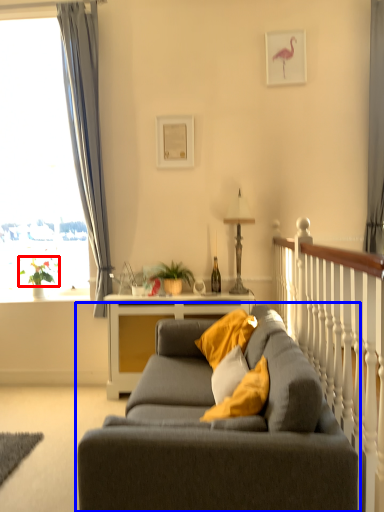
Question: Which object appears closest to the camera in this image, plant (highlighted by a red box) or studio couch (highlighted by a blue box)?

Choices:
 (A) plant
 (B) studio couch

Answer: (B)